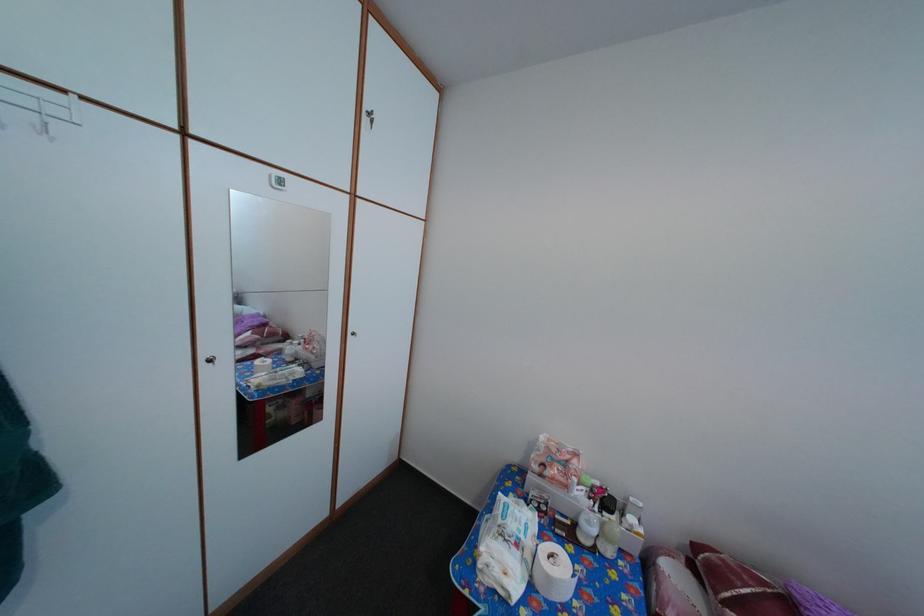
The width and height of the screenshot is (924, 616). Find the location of `white digital thermometer`. white digital thermometer is located at coordinates (276, 180).